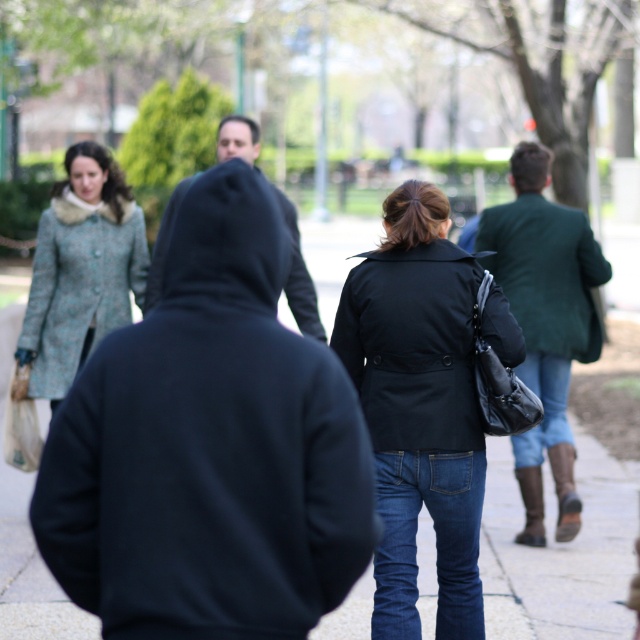
Question: Which point is closer to the camera?

Choices:
 (A) matte black coat at center
 (B) teal textured coat at left

Answer: (A)

Question: Which point is closer to the camera?

Choices:
 (A) (472, 522)
 (B) (108, 204)

Answer: (A)

Question: Does matte black coat at center have a smaller size compared to teal textured coat at left?

Choices:
 (A) yes
 (B) no

Answer: (B)

Question: Is matte black coat at center smaller than teal textured coat at left?

Choices:
 (A) yes
 (B) no

Answer: (B)

Question: Which object is closer to the camera taking this photo?

Choices:
 (A) matte black coat at center
 (B) teal textured coat at left

Answer: (A)

Question: Does matte black coat at center come in front of teal textured coat at left?

Choices:
 (A) no
 (B) yes

Answer: (B)